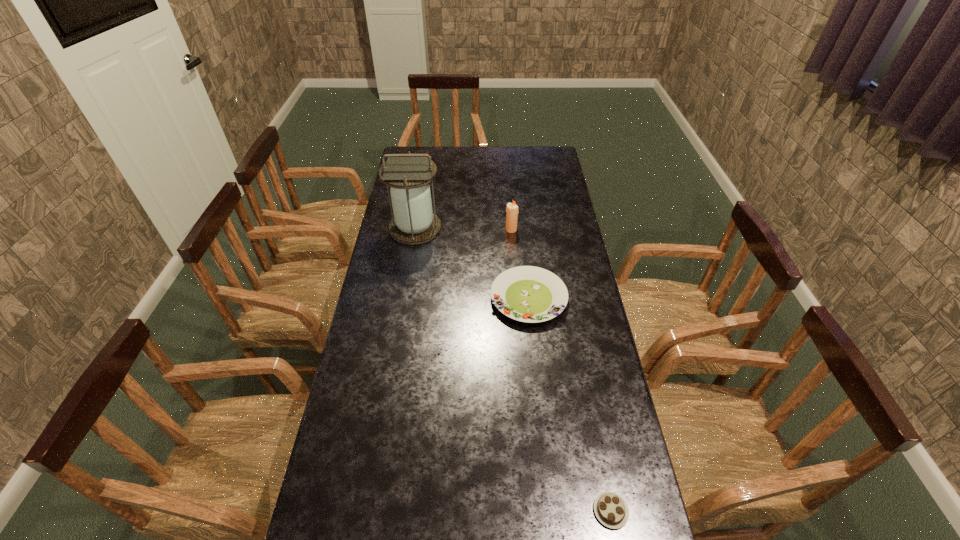
Where is `the leftmost object`? The image size is (960, 540). the leftmost object is located at coordinates (408, 175).

Where is `lantern`? The height and width of the screenshot is (540, 960). lantern is located at coordinates (408, 175).

Where is `candle`? This screenshot has width=960, height=540. candle is located at coordinates (512, 211).

Where is `salad plate`? Image resolution: width=960 pixels, height=540 pixels. salad plate is located at coordinates [530, 294].

Find the location of a particular element. This screenshot has height=540, width=960. the third farthest object is located at coordinates (530, 294).

What are the coordinates of `chocolate cake` in the screenshot? It's located at (610, 508).

Locate an element on the screen. the nearest object is located at coordinates (610, 508).

Where is `vacant space located on the right of the leftmost object`? The height and width of the screenshot is (540, 960). vacant space located on the right of the leftmost object is located at coordinates (513, 228).

Locate an element on the screen. This screenshot has height=540, width=960. free space located on the left of the third shortest object is located at coordinates (445, 230).

Locate an element on the screen. The height and width of the screenshot is (540, 960). vacant space positioned on the back of the third farthest object is located at coordinates (524, 255).